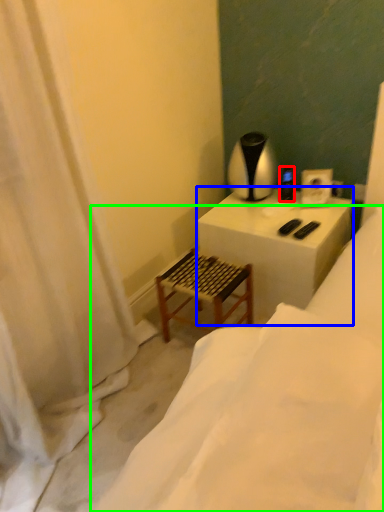
Question: Based on their relative distances, which object is farther from appliance (highlighted by a red box)? Choose from table (highlighted by a blue box) and furniture (highlighted by a green box).

Choices:
 (A) table
 (B) furniture

Answer: (B)